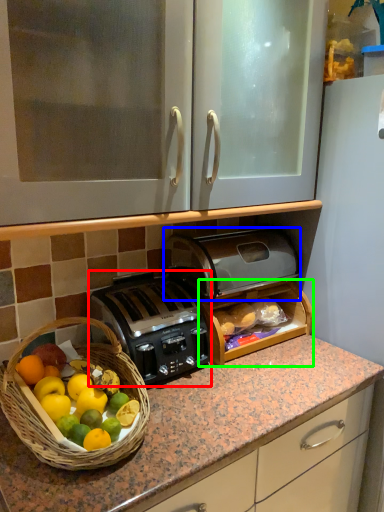
Question: Which is nearer to the toaster (highlighted by a red box)? toaster (highlighted by a blue box) or cabinetry (highlighted by a green box).

Choices:
 (A) toaster
 (B) cabinetry

Answer: (B)